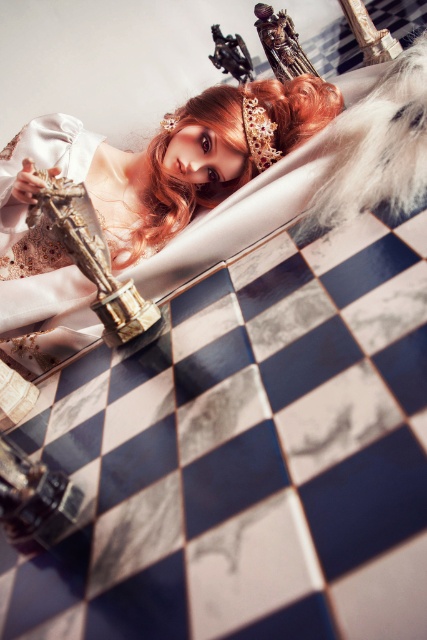
Image resolution: width=427 pixels, height=640 pixels. In order to click on satin white dress at center in this screenshot , I will do `click(140, 182)`.

Which is in front, point (277, 83) or point (160, 218)?

Point (277, 83) is in front.

Between point (154, 232) and point (230, 144), which one is positioned in front?

Point (230, 144) is in front.

Where is `satin white dress at center`? The height and width of the screenshot is (640, 427). satin white dress at center is located at coordinates (140, 182).